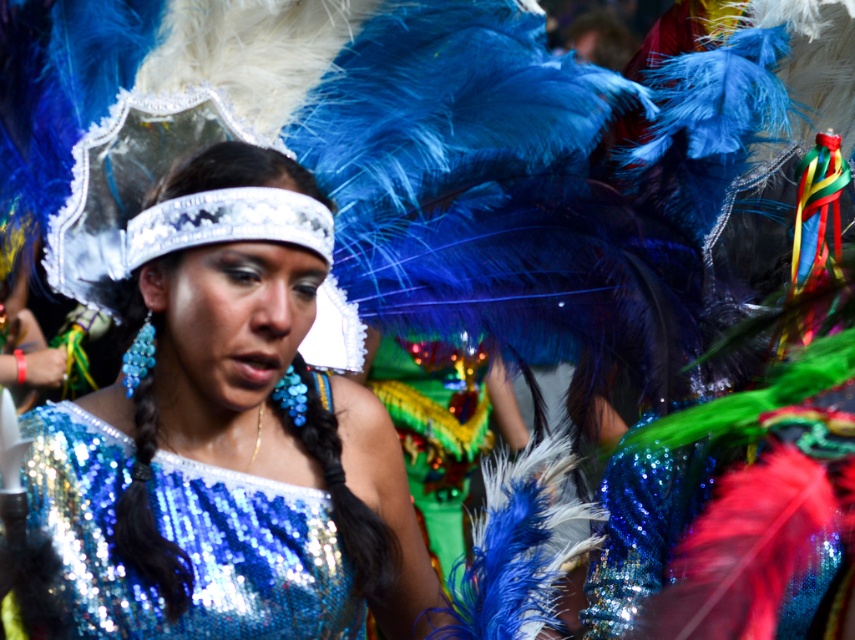
You are at the point labeled point (183,524) and want to walk to the point labeled point (320,422). Given that you can only move forward and cannot go through objects, will you be able to reach your destination without any obstacles blocking your path?

Since point (320,422) is behind point (183,524), you will be blocked by the object at point (183,524) and cannot reach your destination.

You are a photographer at the event and want to capture the central figure in a way that highlights both the shiny sequined dress at center and the shiny sequined top at center. Since you can only focus on one, which one should you choose to ensure it appears taller in the photo?

The shiny sequined dress at center has a greater height compared to the shiny sequined top at center, so you should focus on the shiny sequined dress at center to highlight its taller appearance.

In the festive scene, there are two items with shiny sequined details. The first is the shiny sequined dress at center and the second is the shiny sequined top at center. Which of these two items is positioned to the right side of the other?

The shiny sequined dress at center is to the right of the shiny sequined top at center.